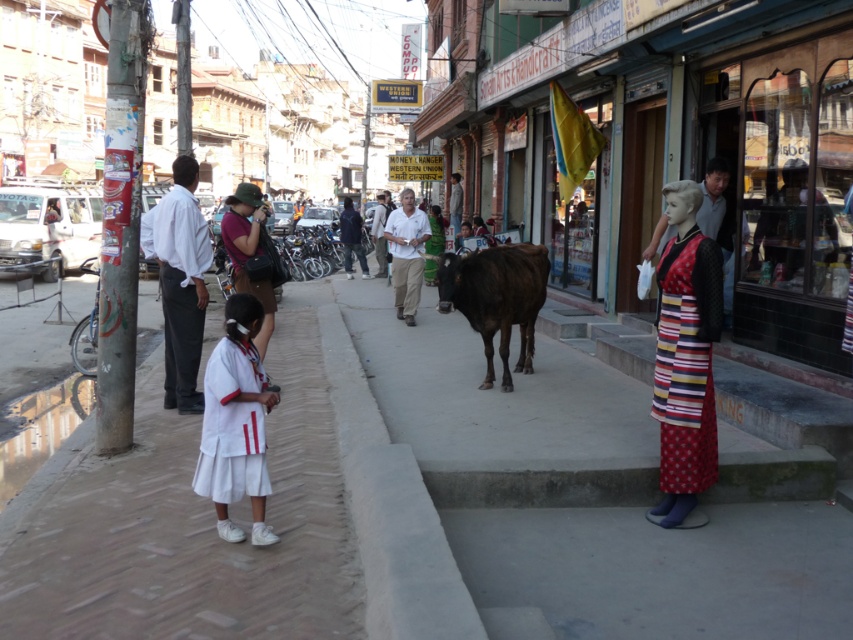
Can you confirm if white concrete pavement at lower left is bigger than matte brown hat at center?

Incorrect, white concrete pavement at lower left is not larger than matte brown hat at center.

Does white concrete pavement at lower left lie in front of matte brown hat at center?

No, white concrete pavement at lower left is behind matte brown hat at center.

This screenshot has height=640, width=853. I want to click on white concrete pavement at lower left, so click(194, 525).

Does white concrete pavement at lower left appear over striped fabric dress at right?

Incorrect, white concrete pavement at lower left is not positioned above striped fabric dress at right.

Describe the element at coordinates (194, 525) in the screenshot. The height and width of the screenshot is (640, 853). I see `white concrete pavement at lower left` at that location.

I want to click on white concrete pavement at lower left, so click(194, 525).

Between brown matte cow at center and matte brown hat at center, which one is positioned lower?

brown matte cow at center

Find the location of a particular element. The height and width of the screenshot is (640, 853). brown matte cow at center is located at coordinates (496, 298).

Identify the location of brown matte cow at center. The width and height of the screenshot is (853, 640). (496, 298).